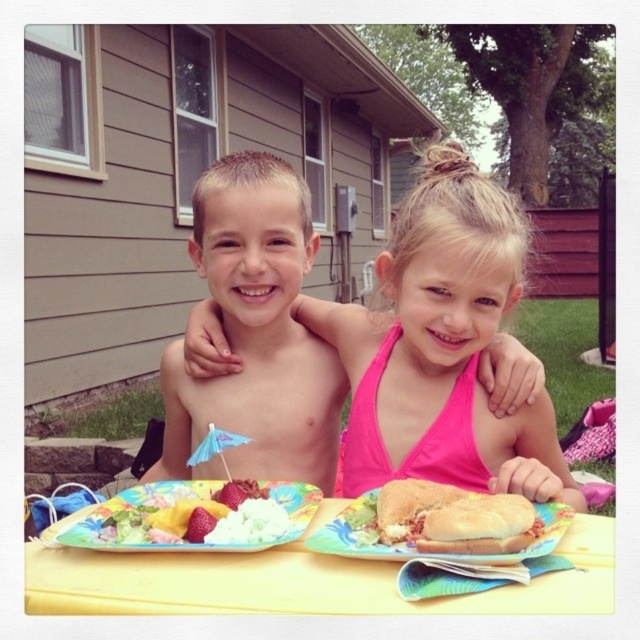
You are a food delivery person who needs to place a small dessert on the table between the matte paper plate at center and the strawberry at center. The dessert requires 6 inches of space to be placed properly. Can you fit it there?

The matte paper plate at center is 9.00 inches from strawberry at center, so yes, the dessert can be placed between them as there is enough space.

What is located at the coordinates point (442, 346)?

The shiny blonde hair at upper center is located at point (442, 346).